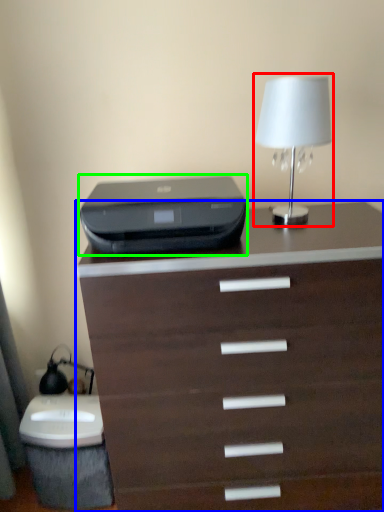
Question: Which object is positioned farthest from table lamp (highlighted by a red box)? Select from chest of drawers (highlighted by a blue box) and printer (highlighted by a green box).

Choices:
 (A) chest of drawers
 (B) printer

Answer: (A)